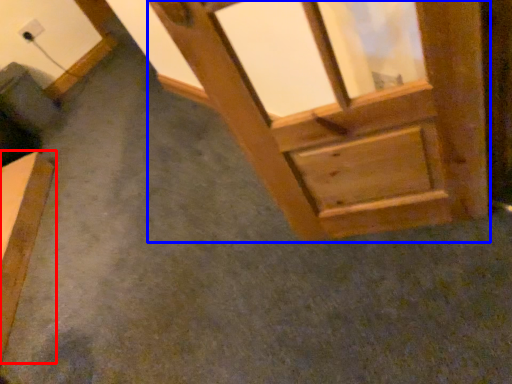
Question: Which point is closer to the camera, furniture (highlighted by a red box) or window frame (highlighted by a blue box)?

Choices:
 (A) furniture
 (B) window frame

Answer: (B)